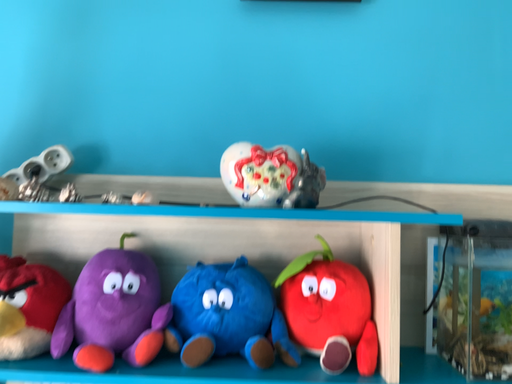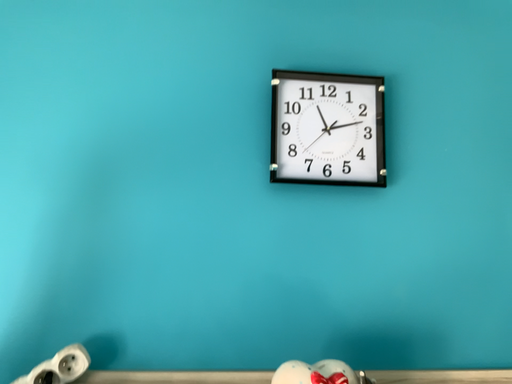
Question: Which way did the camera rotate in the video?

Choices:
 (A) rotated upward
 (B) rotated downward

Answer: (A)